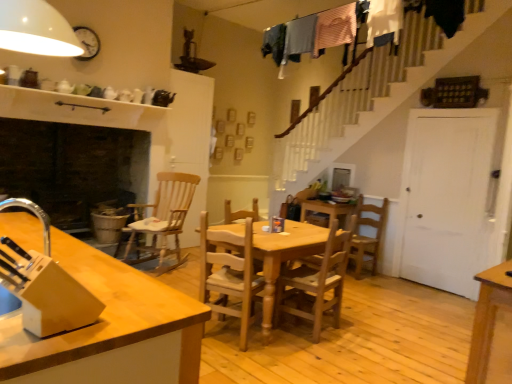
You are a GUI agent. You are given a task and a screenshot of the screen. Output one action in this format:
    pyautogui.click(x=<x>, y=<y>)
    Task: Click on the vacant space to the right of wooden table at center
    The width and height of the screenshot is (512, 384).
    Given the screenshot: What is the action you would take?
    pyautogui.click(x=384, y=331)